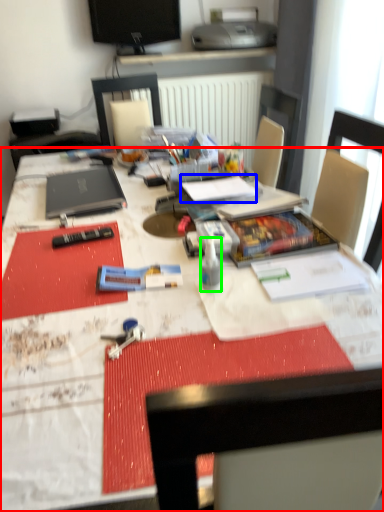
Question: Which object is positioned farthest from desk (highlighted by a red box)? Select from notebook (highlighted by a blue box) and bottle (highlighted by a green box).

Choices:
 (A) notebook
 (B) bottle

Answer: (A)